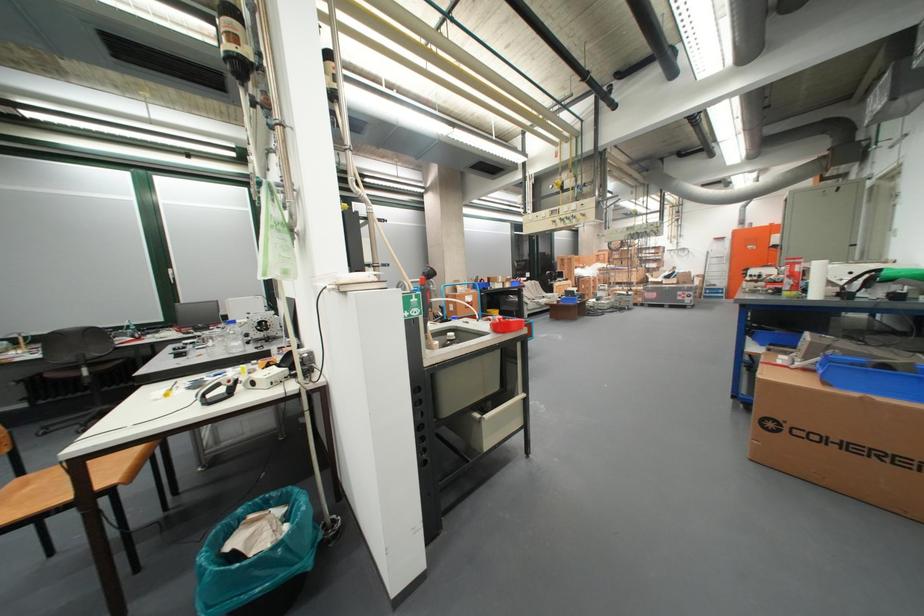
You are a GUI agent. You are given a task and a screenshot of the screen. Output one action in this format:
    pyautogui.click(x=<x>, y=<y>)
    Task: Click on the white paper towel roll
    
    Given the screenshot: What is the action you would take?
    pyautogui.click(x=817, y=280)